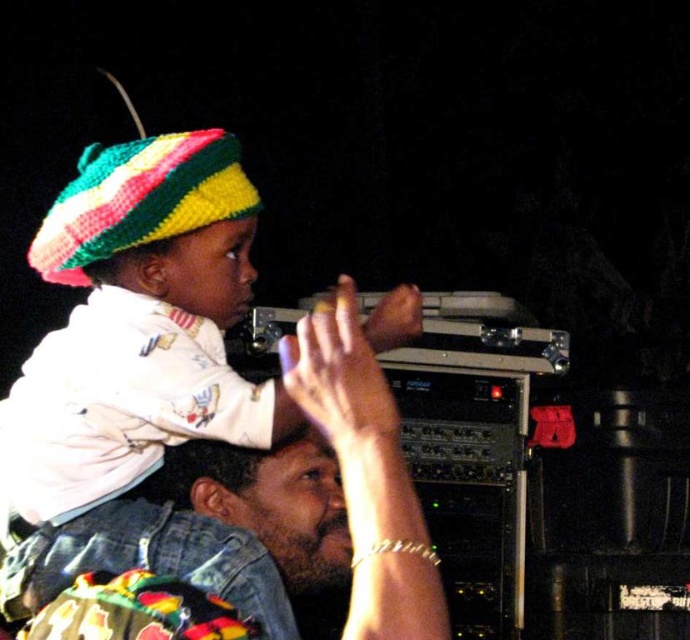
Based on the scene description, where is the jeans at center in relation to the knitted multicolored hat at upper left?

The jeans at center is to the right of the knitted multicolored hat at upper left.

You are standing in front of the image and want to determine which of the two points, point (364, 476) or point (199, 186), is nearer to you. Based on the scene, can you identify which one is closer?

Point (364, 476) is closer to the camera than point (199, 186), so it is the nearer one.

You are a photographer setting up a tripod to capture the scene. The tripod has a height adjustment feature. The jeans at center and gold bracelet at upper center are in your viewfinder. Which object should you focus on if you want to ensure both are in frame without needing to adjust the tripod height again?

You should focus on the jeans at center because it has a greater height compared to the gold bracelet at upper center, ensuring both will be within the frame when the tripod is set to accommodate the taller object.